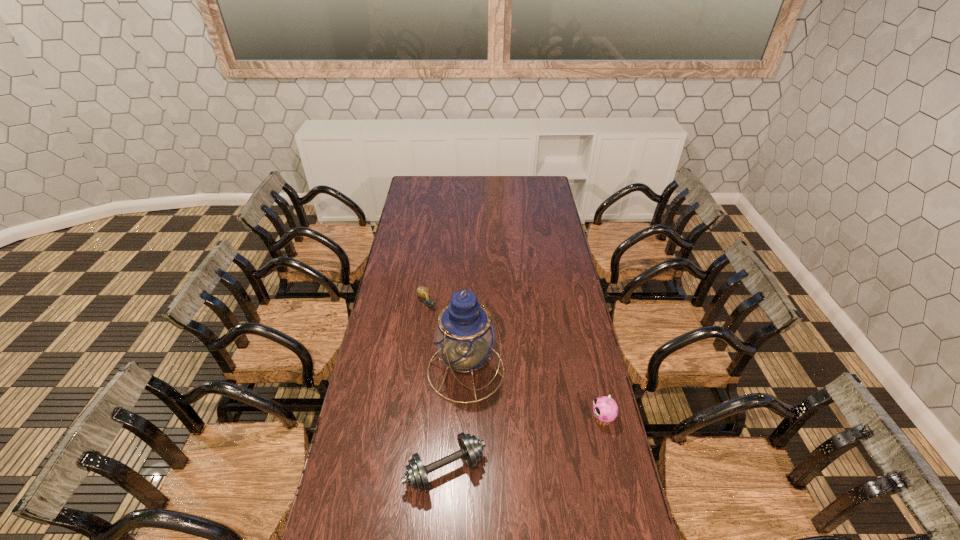
Where is `the nearest object`? The height and width of the screenshot is (540, 960). the nearest object is located at coordinates (471, 448).

Locate an element on the screen. The height and width of the screenshot is (540, 960). the second shortest object is located at coordinates (471, 448).

At what (x,y) coordinates should I click in order to perform the action: click on cupcake. Please return your answer as a coordinate pair (x, y). Looking at the image, I should click on (605, 409).

Find the location of a particular element. The width and height of the screenshot is (960, 540). the third shortest object is located at coordinates (605, 409).

Where is `the shortest object`? the shortest object is located at coordinates (423, 292).

The height and width of the screenshot is (540, 960). Identify the location of the farthest object. (423, 292).

At what (x,y) coordinates should I click in order to perform the action: click on the second farthest object. Please return your answer as a coordinate pair (x, y). This screenshot has width=960, height=540. Looking at the image, I should click on (464, 336).

You are a GUI agent. You are given a task and a screenshot of the screen. Output one action in this format:
    pyautogui.click(x=<x>, y=<y>)
    Task: Click on the lantern
    The height and width of the screenshot is (540, 960).
    Given the screenshot: What is the action you would take?
    pyautogui.click(x=464, y=336)

Find the location of a particular element. free space located 0.090m on the back of the nearest object is located at coordinates (448, 420).

At what (x,y) coordinates should I click in order to perform the action: click on free space located on the face of the rightmost object. Please return your answer as a coordinate pair (x, y). Looking at the image, I should click on (542, 418).